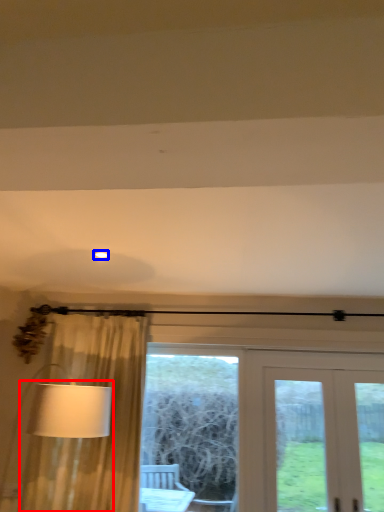
Question: Which of the following is the farthest to the observer, table lamp (highlighted by a red box) or lighting (highlighted by a blue box)?

Choices:
 (A) table lamp
 (B) lighting

Answer: (B)